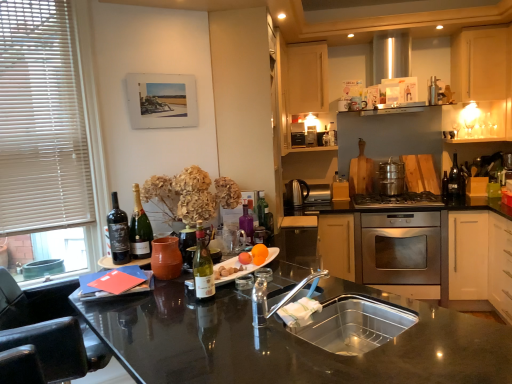
Question: From their relative heights in the image, would you say light wood cabinet at upper center, which is the first cabinetry from left to right, is taller or shorter than green glass bottle at center, acting as the third bottle starting from the left?

Choices:
 (A) tall
 (B) short

Answer: (A)

Question: Considering the positions of light wood cabinet at upper center, which is the first cabinetry from left to right, and green glass bottle at center, positioned as the third bottle in front-to-back order, in the image, is light wood cabinet at upper center, which is the first cabinetry from left to right, wider or thinner than green glass bottle at center, positioned as the third bottle in front-to-back order,?

Choices:
 (A) wide
 (B) thin

Answer: (A)

Question: Which of these objects is positioned farthest from the stainless steel gas stove at center?

Choices:
 (A) green glass wine bottle at right
 (B) black leather swivel chair at left
 (C) satin silver toaster at center, the 1th appliance when ordered from right to left
 (D) green glass bottle at center, positioned as the first bottle in right-to-left order
 (E) matte glass wine at left, positioned as the first wine in left-to-right order

Answer: (B)

Question: Which is nearer to the white blinds at left?

Choices:
 (A) green glass wine bottle at right
 (B) matte glass wine at center, arranged as the second bottle when viewed from the front
 (C) matte ceramic vase at center, which ranks as the third appliance in back-to-front order
 (D) matte gold champagne bottle at left, the first wine when ordered from right to left
 (E) black glossy countertop at center

Answer: (D)